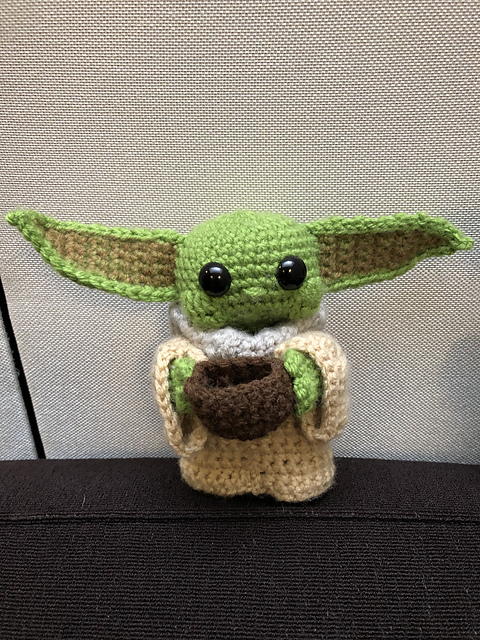
Find the location of `bowl`. bowl is located at coordinates (251, 416).